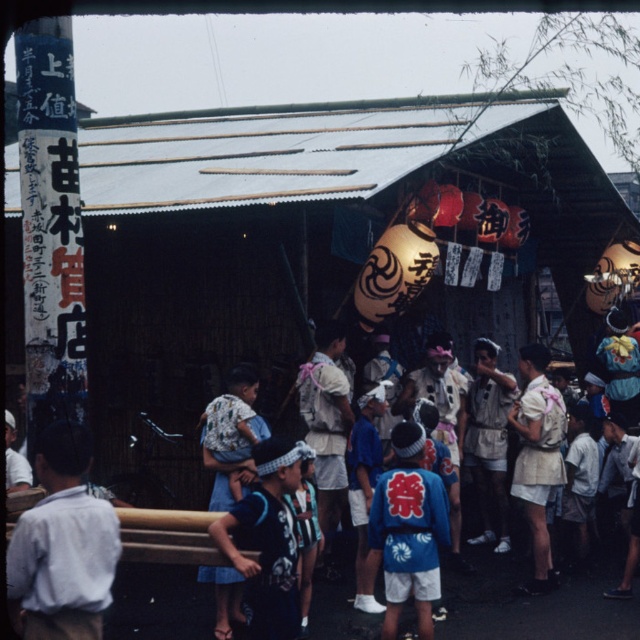
Who is more distant from viewer, (x=42, y=461) or (x=426, y=627)?

Point (x=426, y=627)

Does point (56, 477) come behind point (429, 502)?

No, it is not.

Where is `white cotton shirt at left`? Image resolution: width=640 pixels, height=640 pixels. white cotton shirt at left is located at coordinates (61, 545).

Does wooden hut at center appear over blue fabric kimono at center?

Yes.

Between point (484, 182) and point (401, 534), which one is positioned in front?

Point (401, 534)

This screenshot has height=640, width=640. I want to click on wooden hut at center, so click(316, 234).

Does wooden hut at center lie behind white cotton shirt at left?

Yes.

Between wooden hut at center and white cotton shirt at left, which one is positioned lower?

white cotton shirt at left is below.

Does point (368, 225) come farther from viewer compared to point (76, 525)?

Yes, point (368, 225) is farther from viewer.

Find the location of a particular element. The height and width of the screenshot is (640, 640). wooden hut at center is located at coordinates (316, 234).